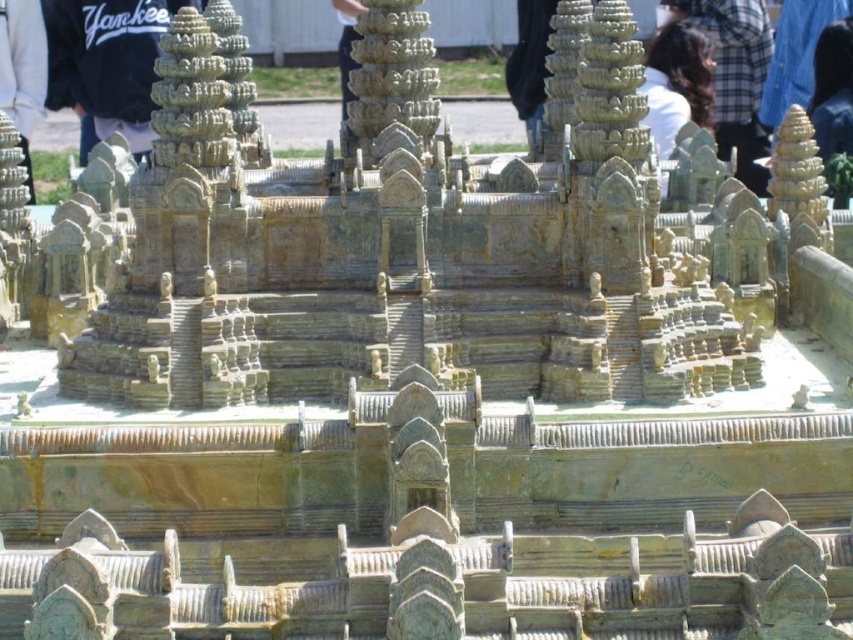
What do you see at coordinates (108, 61) in the screenshot? I see `black cotton hoodie at upper left` at bounding box center [108, 61].

Can you confirm if black cotton hoodie at upper left is bigger than brown hair at upper center?

Yes.

Based on the photo, measure the distance between point (61, 76) and camera.

They are 143.00 meters apart.

Where is `black cotton hoodie at upper left`? Image resolution: width=853 pixels, height=640 pixels. black cotton hoodie at upper left is located at coordinates (108, 61).